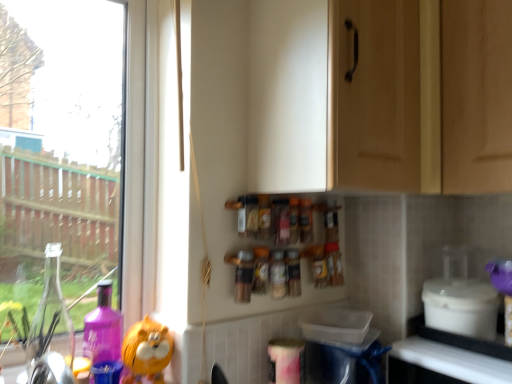
Measure the distance between point (x=166, y=363) and camera.

Point (x=166, y=363) and camera are 38.94 inches apart from each other.

Describe the element at coordinates (293, 272) in the screenshot. I see `translucent plastic spice jar at center, marked as the first bottle in a right-to-left arrangement` at that location.

Where is `matte wood cabinet at upper center`? This screenshot has width=512, height=384. matte wood cabinet at upper center is located at coordinates (396, 102).

The height and width of the screenshot is (384, 512). What do you see at coordinates (103, 328) in the screenshot? I see `purple glossy bottle at left` at bounding box center [103, 328].

The image size is (512, 384). Find the location of `translucent plastic spice jar at center, arranged as the third bottle when viewed from the right`. translucent plastic spice jar at center, arranged as the third bottle when viewed from the right is located at coordinates (244, 276).

What do you see at coordinates (453, 361) in the screenshot? Image resolution: width=512 pixels, height=384 pixels. I see `white glossy counter top at lower right` at bounding box center [453, 361].

This screenshot has width=512, height=384. What do you see at coordinates (461, 307) in the screenshot? I see `white plastic container at lower right` at bounding box center [461, 307].

At what (x,y) coordinates should I click in order to perform the action: click on orange matte plush toy at lower left. Please return your answer as a coordinate pair (x, y). Image resolution: width=512 pixels, height=384 pixels. Looking at the image, I should click on (146, 352).

Does translucent plastic spice jar at center, marked as the first bottle in a right-to-left arrangement, have a lesser height compared to purple glossy bottle at left?

Indeed, translucent plastic spice jar at center, marked as the first bottle in a right-to-left arrangement, has a lesser height compared to purple glossy bottle at left.

Considering the positions of point (298, 266) and point (111, 321), is point (298, 266) closer or farther from the camera than point (111, 321)?

Clearly, point (298, 266) is more distant from the camera than point (111, 321).

Are translucent plastic spice jar at center, the third bottle when ordered from left to right, and purple glossy bottle at left located far from each other?

No, translucent plastic spice jar at center, the third bottle when ordered from left to right, is in close proximity to purple glossy bottle at left.

Looking at this image, from the image's perspective, which one is positioned higher, translucent plastic spice jar at center, marked as the first bottle in a right-to-left arrangement, or purple glossy bottle at left?

translucent plastic spice jar at center, marked as the first bottle in a right-to-left arrangement.

Is orange matte plush toy at lower left aimed at translucent plastic spice jar at center, which is counted as the 2th bottle, starting from the left?

No, orange matte plush toy at lower left is not turned towards translucent plastic spice jar at center, which is counted as the 2th bottle, starting from the left.

You are a GUI agent. You are given a task and a screenshot of the screen. Output one action in this format:
    pyautogui.click(x=<x>, y=<y>)
    Task: Click on the bottle that is the 2nd object located behind the orange matte plush toy at lower left
    
    Given the screenshot: What is the action you would take?
    pyautogui.click(x=277, y=274)

Is orange matte plush toy at lower left far from translucent plastic spice jar at center, placed as the 2th bottle when sorted from right to left?

That's not correct — orange matte plush toy at lower left is a little close to translucent plastic spice jar at center, placed as the 2th bottle when sorted from right to left.

Considering the relative sizes of orange matte plush toy at lower left and translucent plastic spice jar at center, placed as the 2th bottle when sorted from right to left, in the image provided, is orange matte plush toy at lower left bigger than translucent plastic spice jar at center, placed as the 2th bottle when sorted from right to left,?

Correct, orange matte plush toy at lower left is larger in size than translucent plastic spice jar at center, placed as the 2th bottle when sorted from right to left.

How different are the orientations of white plastic container at lower right and white glossy counter top at lower right in degrees?

The angular difference between white plastic container at lower right and white glossy counter top at lower right is 2.08 degrees.

Looking at this image, which is in front, white plastic container at lower right or white glossy counter top at lower right?

Positioned in front is white glossy counter top at lower right.

Is white plastic container at lower right facing away from white glossy counter top at lower right?

No, white plastic container at lower right's orientation is not away from white glossy counter top at lower right.

From a real-world perspective, who is located higher, white plastic container at lower right or white glossy counter top at lower right?

→ white plastic container at lower right, from a real-world perspective.

From a real-world perspective, which object rests below the other?

white plastic container at lower right.

Can you tell me how much white plastic container at lower right and matte wood cabinet at upper center differ in facing direction?

The facing directions of white plastic container at lower right and matte wood cabinet at upper center are 86.1 degrees apart.

Is white plastic container at lower right at the left side of matte wood cabinet at upper center?

Incorrect, white plastic container at lower right is not on the left side of matte wood cabinet at upper center.

From a real-world perspective, between white plastic container at lower right and purple glossy bottle at left, who is vertically lower?

purple glossy bottle at left, from a real-world perspective.

Relative to purple glossy bottle at left, is white plastic container at lower right in front or behind?

Clearly, white plastic container at lower right is in front of purple glossy bottle at left.

Considering the sizes of matte wood cabinet at upper center and translucent plastic spice jar at center, placed as the 2th bottle when sorted from right to left, in the image, is matte wood cabinet at upper center taller or shorter than translucent plastic spice jar at center, placed as the 2th bottle when sorted from right to left,?

In the image, matte wood cabinet at upper center appears to be taller than translucent plastic spice jar at center, placed as the 2th bottle when sorted from right to left.

Where is `cabinetry above the translucent plastic spice jar at center, placed as the 2th bottle when sorted from right to left (from the image's perspective)`? cabinetry above the translucent plastic spice jar at center, placed as the 2th bottle when sorted from right to left (from the image's perspective) is located at coordinates (396, 102).

Between matte wood cabinet at upper center and translucent plastic spice jar at center, which is counted as the 2th bottle, starting from the left, which one appears on the right side from the viewer's perspective?

From the viewer's perspective, matte wood cabinet at upper center appears more on the right side.

Consider the image. How many degrees apart are the facing directions of matte wood cabinet at upper center and translucent plastic spice jar at center, placed as the 2th bottle when sorted from right to left?

5.83 degrees separate the facing orientations of matte wood cabinet at upper center and translucent plastic spice jar at center, placed as the 2th bottle when sorted from right to left.

Starting from the white plastic container at lower right, which bottle is the 2nd one behind? Please provide its 2D coordinates.

[(277, 274)]

From the picture: Is white plastic container at lower right facing away from translucent plastic spice jar at center, placed as the 2th bottle when sorted from right to left?

Result: white plastic container at lower right is not turned away from translucent plastic spice jar at center, placed as the 2th bottle when sorted from right to left.

From the image's perspective, which is below, white plastic container at lower right or translucent plastic spice jar at center, placed as the 2th bottle when sorted from right to left?

white plastic container at lower right, from the image's perspective.

Is the surface of white plastic container at lower right in direct contact with translucent plastic spice jar at center, placed as the 2th bottle when sorted from right to left?

No, white plastic container at lower right is not beside translucent plastic spice jar at center, placed as the 2th bottle when sorted from right to left.

Where is `the 2nd bottle located above the purple glossy bottle at left (from a real-world perspective)`? This screenshot has height=384, width=512. the 2nd bottle located above the purple glossy bottle at left (from a real-world perspective) is located at coordinates (293, 272).

The width and height of the screenshot is (512, 384). What are the coordinates of `the 2nd bottle to the right of the orange matte plush toy at lower left, counting from the anchor's position` in the screenshot? It's located at (277, 274).

Estimate the real-world distances between objects in this image. Which object is closer to purple glossy bottle at left, translucent plastic spice jar at center, marked as the first bottle in a right-to-left arrangement, or translucent plastic spice jar at center, arranged as the third bottle when viewed from the right?

translucent plastic spice jar at center, arranged as the third bottle when viewed from the right.

Estimate the real-world distances between objects in this image. Which object is closer to translucent plastic spice jar at center, which is counted as the 2th bottle, starting from the left, orange matte plush toy at lower left or white glossy counter top at lower right?

orange matte plush toy at lower left.

Looking at the image, which one is located further to translucent plastic spice jar at center, which is counted as the 2th bottle, starting from the left, translucent plastic spice jar at center, the first bottle from the left, or translucent plastic spice jar at center, the third bottle when ordered from left to right?

translucent plastic spice jar at center, the first bottle from the left, lies further to translucent plastic spice jar at center, which is counted as the 2th bottle, starting from the left, than the other object.

From the picture: Considering their positions, is white glossy counter top at lower right positioned further to orange matte plush toy at lower left than translucent plastic spice jar at center, the first bottle from the left?

white glossy counter top at lower right lies further to orange matte plush toy at lower left than the other object.

From the picture: When comparing their distances from matte wood cabinet at upper center, does purple glossy bottle at left or translucent plastic spice jar at center, the third bottle when ordered from left to right, seem further?

Based on the image, purple glossy bottle at left appears to be further to matte wood cabinet at upper center.

In the scene shown: Which object lies nearer to the anchor point translucent plastic spice jar at center, placed as the 2th bottle when sorted from right to left, purple glossy bottle at left or translucent plastic spice jar at center, marked as the first bottle in a right-to-left arrangement?

translucent plastic spice jar at center, marked as the first bottle in a right-to-left arrangement, is closer to translucent plastic spice jar at center, placed as the 2th bottle when sorted from right to left.

Looking at the image, which one is located closer to translucent plastic spice jar at center, the third bottle when ordered from left to right, white plastic container at lower right or white glossy counter top at lower right?

white glossy counter top at lower right is closer to translucent plastic spice jar at center, the third bottle when ordered from left to right.

Looking at the image, which one is located closer to translucent plastic spice jar at center, the third bottle when ordered from left to right, white glossy counter top at lower right or matte wood cabinet at upper center?

white glossy counter top at lower right.

Identify the location of appliance between orange matte plush toy at lower left and white glossy counter top at lower right. The height and width of the screenshot is (384, 512). (461, 307).

Where is `cabinetry between purple glossy bottle at left and white glossy counter top at lower right in the horizontal direction`? cabinetry between purple glossy bottle at left and white glossy counter top at lower right in the horizontal direction is located at coordinates (396, 102).

Where is `toy located between purple glossy bottle at left and translucent plastic spice jar at center, which is counted as the 2th bottle, starting from the left, in the left-right direction`? The width and height of the screenshot is (512, 384). toy located between purple glossy bottle at left and translucent plastic spice jar at center, which is counted as the 2th bottle, starting from the left, in the left-right direction is located at coordinates (146, 352).

Find the location of a particular element. The width and height of the screenshot is (512, 384). cabinetry located between orange matte plush toy at lower left and white plastic container at lower right in the left-right direction is located at coordinates (396, 102).